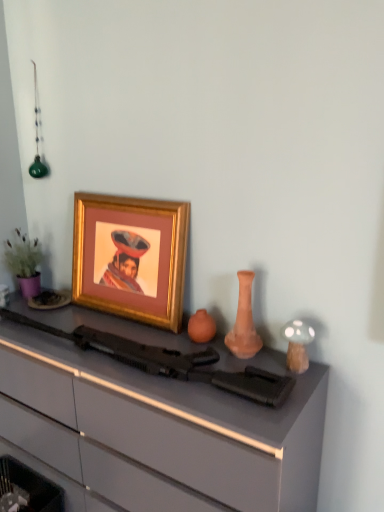
At what (x,y) coordinates should I click in order to perform the action: click on free space in front of white glossy mushroom at right. Please return your answer as a coordinate pair (x, y). Looking at the image, I should click on (286, 402).